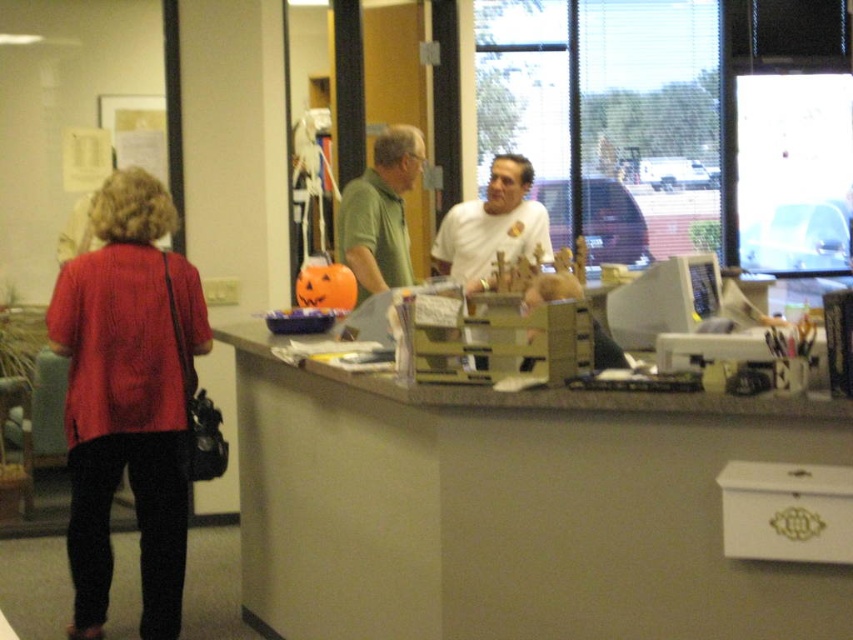
You are an office cleaner who needs to reach the green matte shirt at center and the white matte shirt at center to tidy up. Since you can only move one of them, which one should you move to access the other?

Since the green matte shirt at center is in front of the white matte shirt at center, you should move the green matte shirt at center to access the white matte shirt at center.

You are a delivery person standing at the entrance of the office. You need to hand a package to the person closest to you at the counter. Which person should you approach, the green matte shirt at center or the white matte shirt at center?

The green matte shirt at center is 19.78 inches away from the white matte shirt at center. Since you are at the entrance, the distance to each person depends on their position relative to the entrance. However, the problem states that the green and white shirts are at the center, so their distance from the entrance is similar. Without additional information on their exact positions along the counter, it is impossible to determine which is closer to you. Please clarify their positions along the counter or if

In the scene shown: You are a visitor in an office and need to place a document on the matte gray desk at center. To do this, should you walk around the white matte shirt at center to your left or right side?

The matte gray desk at center is to the left of the white matte shirt at center, so you should walk around the white matte shirt at center to your right side to reach the desk.